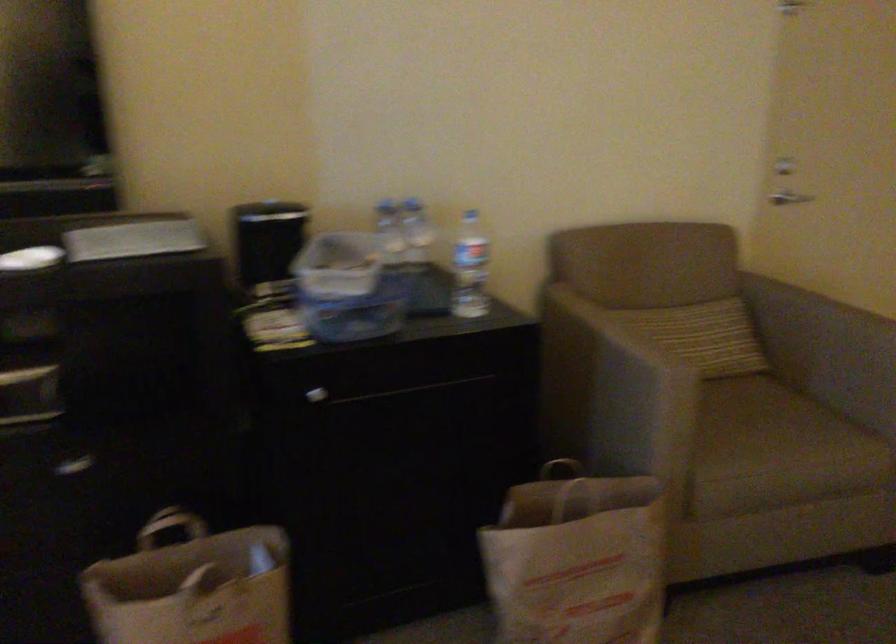
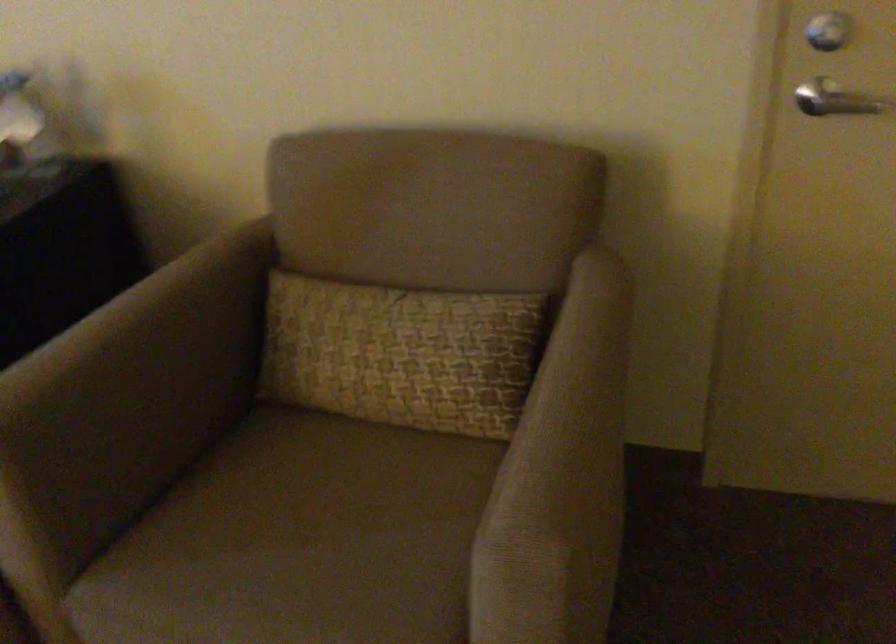
In the second image, find the point that corresponds to point 728,409 in the first image.

(314, 500)